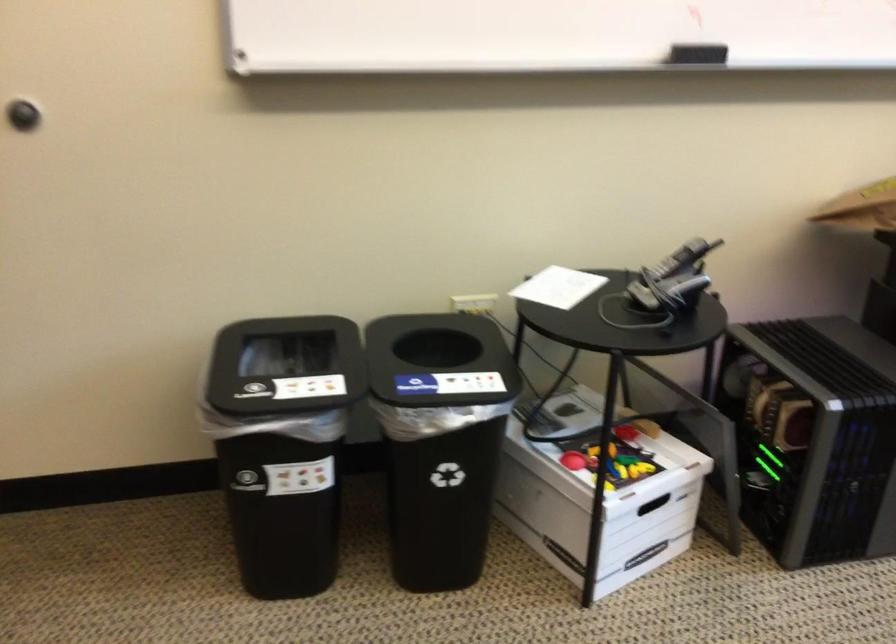
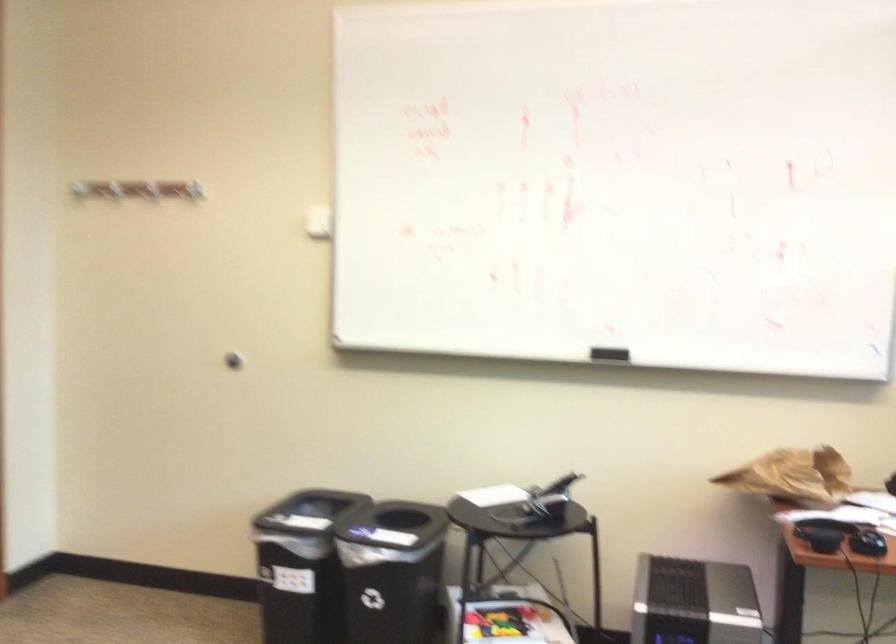
The point at (664, 287) is marked in the first image. Where is the corresponding point in the second image?

(539, 503)